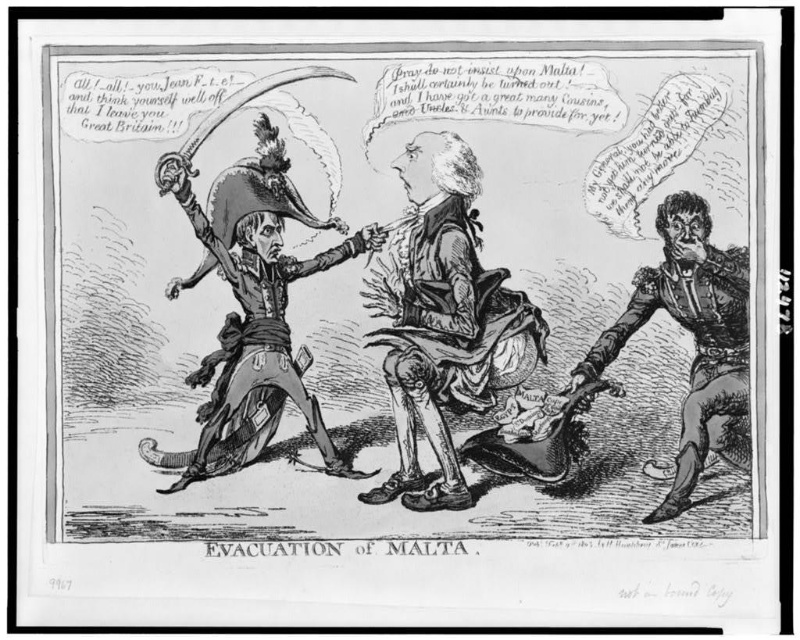
In the cartoon, there is a figure holding a shiny black sword at center and wearing a smooth leather glove at right. Which object is positioned to the left of the other?

The shiny black sword at center is to the left of the smooth leather glove at right.

You are an art conservator examining the cartoon and notice the brushed metal sword at left and the smooth leather glove at right. Which object appears nearer to you in the image?

The brushed metal sword at left is closer to the viewer than the smooth leather glove at right.